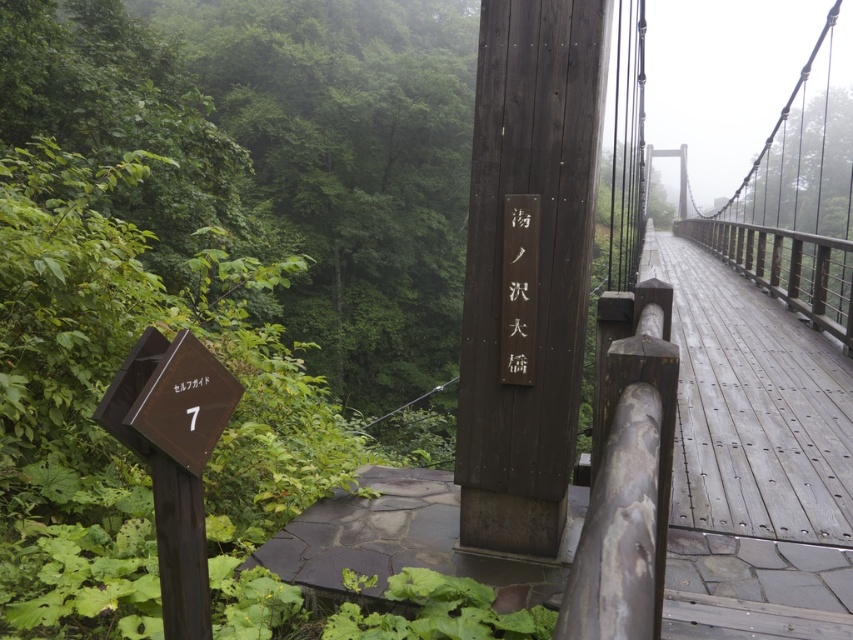
You are hiking on a wooden suspension bridge and notice two signs. One is the brown wooden sign at lower left and the other is the wooden sign at center. Which sign is positioned lower from your viewpoint?

The brown wooden sign at lower left is positioned below the wooden sign at center, so it is lower from your viewpoint.

You are a hiker trying to read both the brown wooden sign at center and the brown wooden sign at lower left. Which sign should you look up to read?

The brown wooden sign at center is taller than the brown wooden sign at lower left, so you should look up to read the brown wooden sign at center.